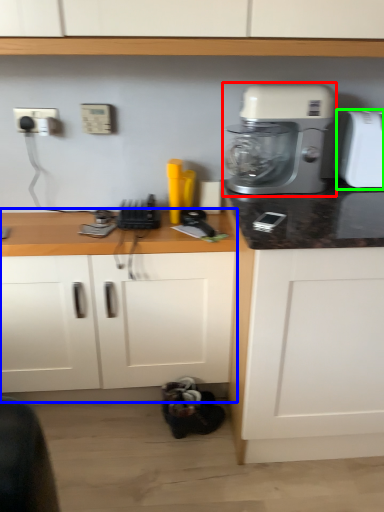
Question: Considering the real-world distances, which object is farthest from mixer (highlighted by a red box)? counter (highlighted by a blue box) or toaster (highlighted by a green box)?

Choices:
 (A) counter
 (B) toaster

Answer: (A)